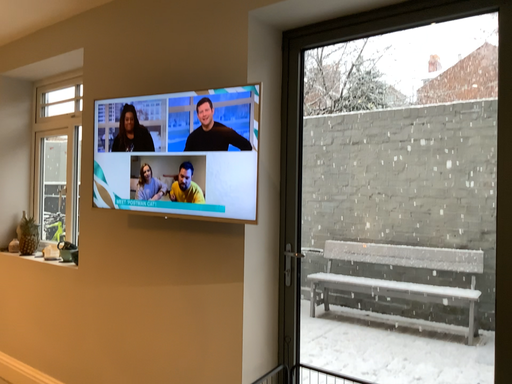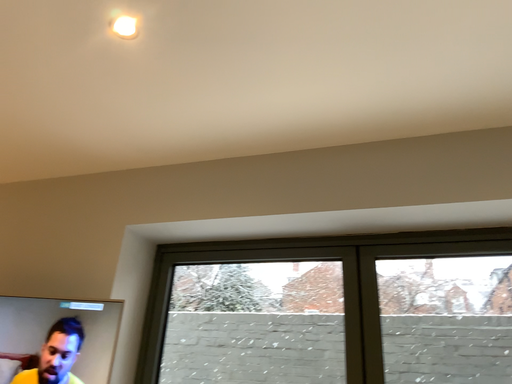
Question: Which way did the camera rotate in the video?

Choices:
 (A) rotated downward
 (B) rotated upward

Answer: (B)